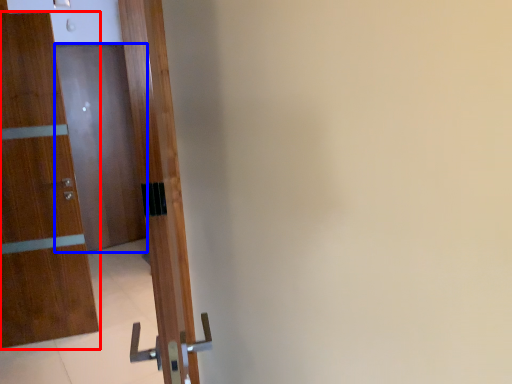
Question: Among these objects, which one is nearest to the camera, door (highlighted by a red box) or door (highlighted by a blue box)?

Choices:
 (A) door
 (B) door

Answer: (A)